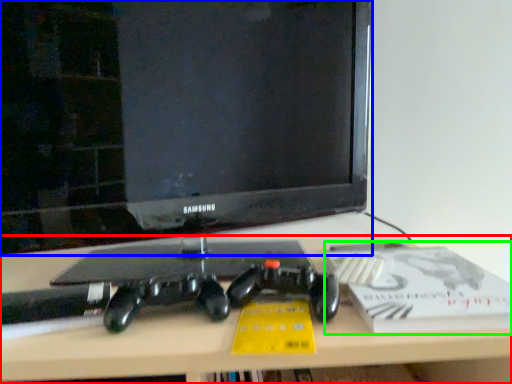
Question: Which object is positioned closest to desk (highlighted by a red box)? Select from television (highlighted by a blue box) and paperback book (highlighted by a green box).

Choices:
 (A) television
 (B) paperback book

Answer: (B)